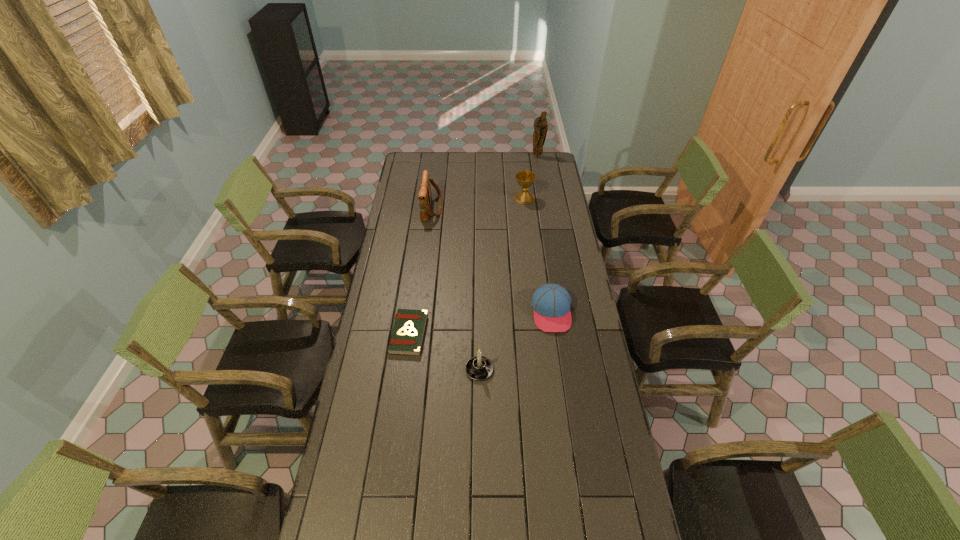
The width and height of the screenshot is (960, 540). What are the coordinates of `vacant point located on the left of the chalice` in the screenshot? It's located at (475, 198).

You are a GUI agent. You are given a task and a screenshot of the screen. Output one action in this format:
    pyautogui.click(x=<x>, y=<y>)
    Task: Click on the vacant space located 0.260m with a handle on the side of the nearest object
    The width and height of the screenshot is (960, 540).
    Given the screenshot: What is the action you would take?
    pyautogui.click(x=479, y=306)

Find the location of a particular element. This screenshot has width=960, height=540. free spot located 0.270m with a handle on the side of the nearest object is located at coordinates (479, 305).

Find the location of `vacant space located with a handle on the side of the nearest object`. vacant space located with a handle on the side of the nearest object is located at coordinates (479, 315).

The image size is (960, 540). Find the location of `free region located on the front-facing side of the fifth tallest object`. free region located on the front-facing side of the fifth tallest object is located at coordinates [x=563, y=385].

Image resolution: width=960 pixels, height=540 pixels. What are the coordinates of `vacant space positioned 0.260m on the right of the book` in the screenshot? It's located at (491, 334).

Locate an element on the screen. The width and height of the screenshot is (960, 540). object positioned at the far edge is located at coordinates (540, 124).

This screenshot has height=540, width=960. I want to click on shoulder bag at the left edge, so click(x=424, y=196).

The image size is (960, 540). In order to click on book that is at the left edge in this screenshot , I will do click(408, 331).

This screenshot has height=540, width=960. In order to click on figurine that is at the right edge in this screenshot , I will do `click(540, 124)`.